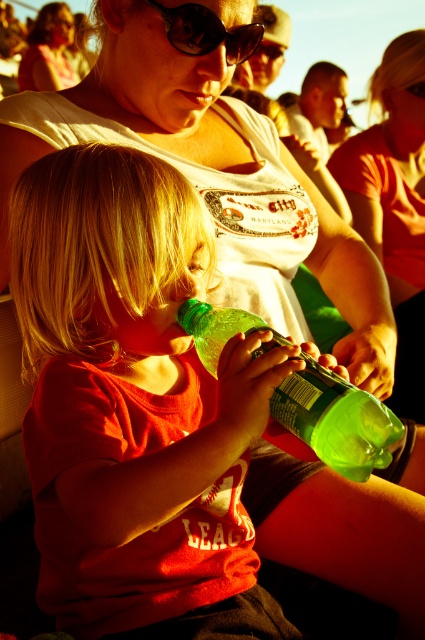
What object is located at the coordinates point [337,420] in the image?

The green translucent bottle at center is located at point [337,420].